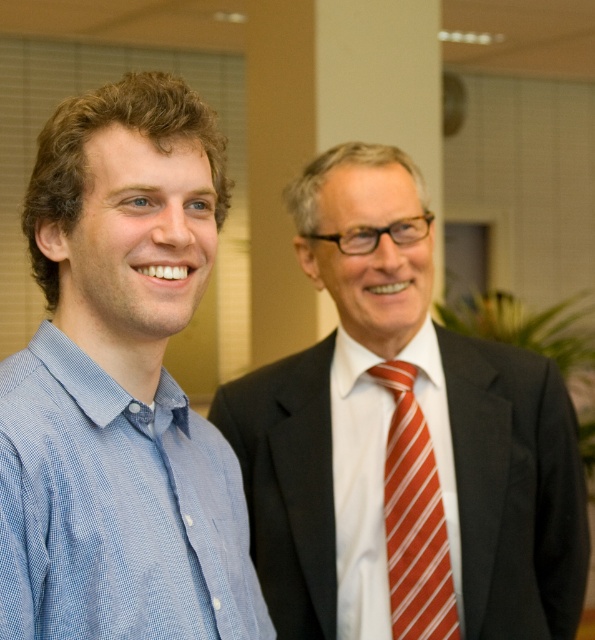
Question: Considering the real-world distances, which object is closest to the red striped tie at center?

Choices:
 (A) blue checkered shirt at left
 (B) matte black suit at right

Answer: (B)

Question: Among these points, which one is nearest to the camera?

Choices:
 (A) (252, 572)
 (B) (418, 531)
 (C) (583, 588)

Answer: (A)

Question: Observing the image, what is the correct spatial positioning of matte black suit at right in reference to red striped tie at center?

Choices:
 (A) below
 (B) above

Answer: (B)

Question: Is the position of blue checkered shirt at left more distant than that of red striped tie at center?

Choices:
 (A) no
 (B) yes

Answer: (A)

Question: Does matte black suit at right appear on the right side of red striped tie at center?

Choices:
 (A) no
 (B) yes

Answer: (A)

Question: Which of the following is the closest to the observer?

Choices:
 (A) (238, 412)
 (B) (400, 636)

Answer: (B)